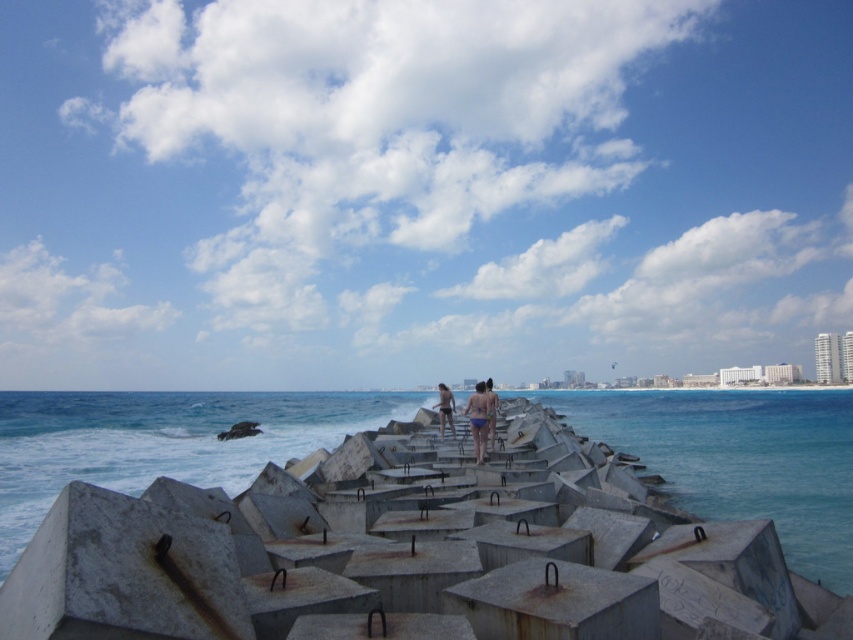
Is rusty concrete water at center thinner than blue swimsuit at center?

No, rusty concrete water at center is not thinner than blue swimsuit at center.

This screenshot has width=853, height=640. I want to click on rusty concrete water at center, so click(x=160, y=442).

Between point (42, 392) and point (489, 396), which one is positioned in front?

Point (489, 396) is in front.

This screenshot has width=853, height=640. What are the coordinates of `rusty concrete water at center` in the screenshot? It's located at (160, 442).

Who is taller, rusty concrete water at center or matte gray concrete at center?

rusty concrete water at center

Can you confirm if rusty concrete water at center is wider than matte gray concrete at center?

Yes.

The height and width of the screenshot is (640, 853). Find the location of `rusty concrete water at center`. rusty concrete water at center is located at coordinates (160, 442).

Find the location of a particular element. The height and width of the screenshot is (640, 853). rusty concrete water at center is located at coordinates click(x=160, y=442).

Is blue concrete water at center positioned in front of matte gray concrete at center?

Yes, it is.

Between blue concrete water at center and matte gray concrete at center, which one has more height?

blue concrete water at center is taller.

Who is more forward, (708, 419) or (450, 404)?

Point (450, 404) is in front.

Where is `blue concrete water at center`? This screenshot has width=853, height=640. blue concrete water at center is located at coordinates (738, 458).